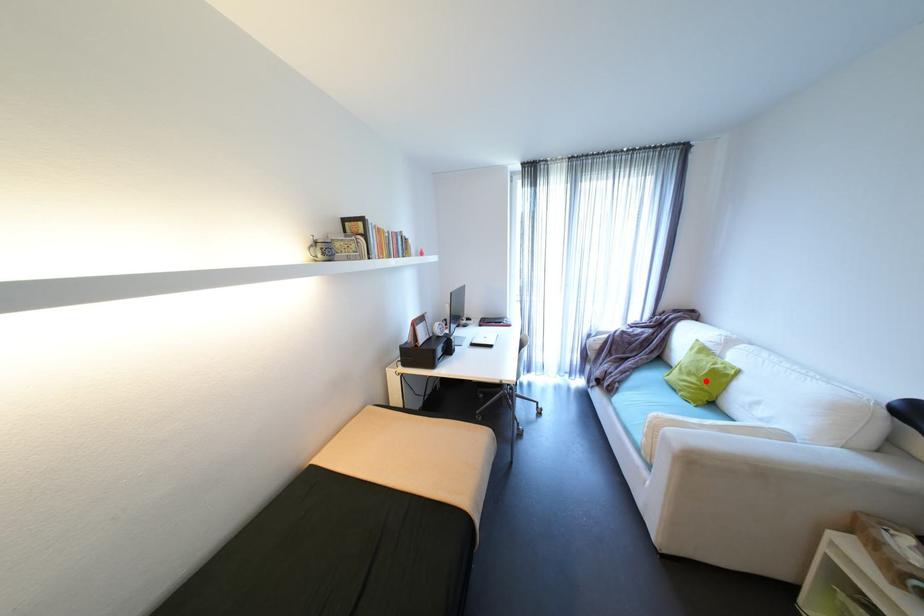
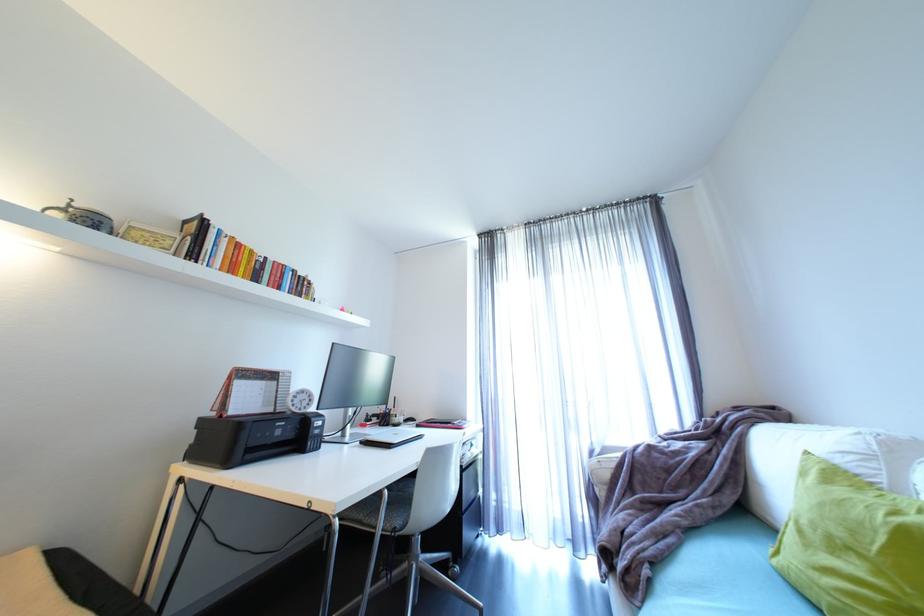
Find the pixel in the second image that matches the highlighted location in the first image.

(885, 573)